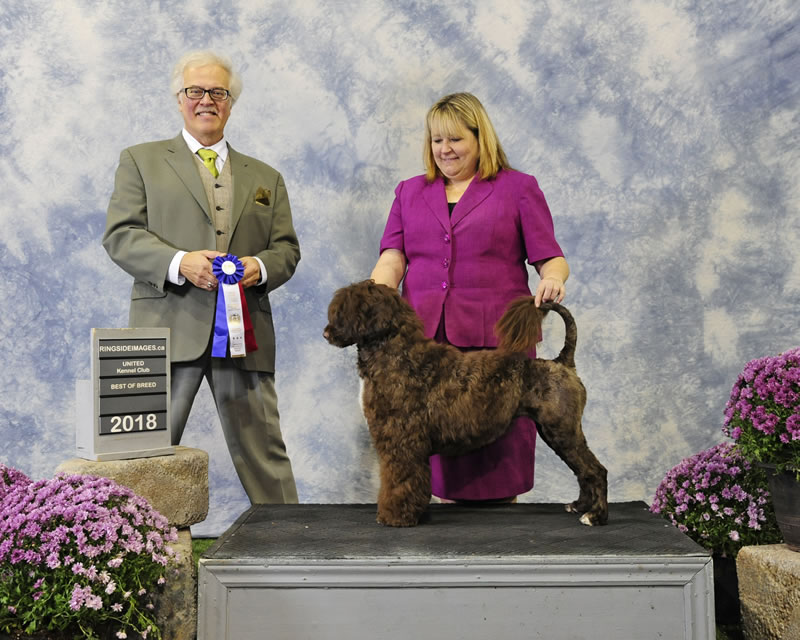
The width and height of the screenshot is (800, 640). Find the location of `award`. award is located at coordinates (226, 312).